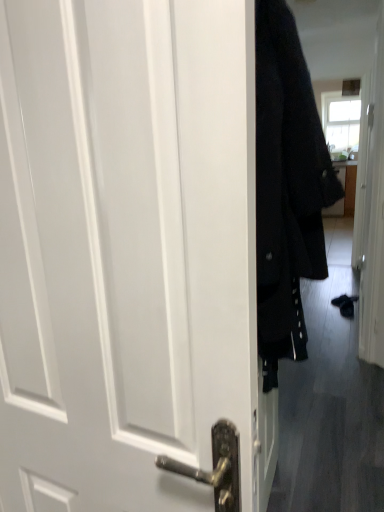
Question: From a real-world perspective, is velvet black coat at right below white matte door at center?

Choices:
 (A) yes
 (B) no

Answer: (B)

Question: Is velvet black coat at right not inside white matte door at center?

Choices:
 (A) no
 (B) yes

Answer: (B)

Question: From a real-world perspective, is velvet black coat at right on white matte door at center?

Choices:
 (A) no
 (B) yes

Answer: (B)

Question: Does velvet black coat at right have a lesser height compared to white matte door at center?

Choices:
 (A) yes
 (B) no

Answer: (B)

Question: Does velvet black coat at right have a smaller size compared to white matte door at center?

Choices:
 (A) yes
 (B) no

Answer: (B)

Question: Considering the relative sizes of velvet black coat at right and white matte door at center in the image provided, is velvet black coat at right thinner than white matte door at center?

Choices:
 (A) yes
 (B) no

Answer: (B)

Question: Is white matte door at center further to camera compared to velvet black coat at right?

Choices:
 (A) no
 (B) yes

Answer: (A)

Question: Does white matte door at center come in front of velvet black coat at right?

Choices:
 (A) no
 (B) yes

Answer: (B)

Question: From a real-world perspective, is white matte door at center over velvet black coat at right?

Choices:
 (A) no
 (B) yes

Answer: (A)

Question: Considering the relative sizes of white matte door at center and velvet black coat at right in the image provided, is white matte door at center thinner than velvet black coat at right?

Choices:
 (A) no
 (B) yes

Answer: (B)

Question: Considering the relative sizes of white matte door at center and velvet black coat at right in the image provided, is white matte door at center wider than velvet black coat at right?

Choices:
 (A) yes
 (B) no

Answer: (B)

Question: Is white matte door at center beside velvet black coat at right?

Choices:
 (A) yes
 (B) no

Answer: (B)

Question: From a real-world perspective, is white matte door at center positioned above or below velvet black coat at right?

Choices:
 (A) below
 (B) above

Answer: (A)